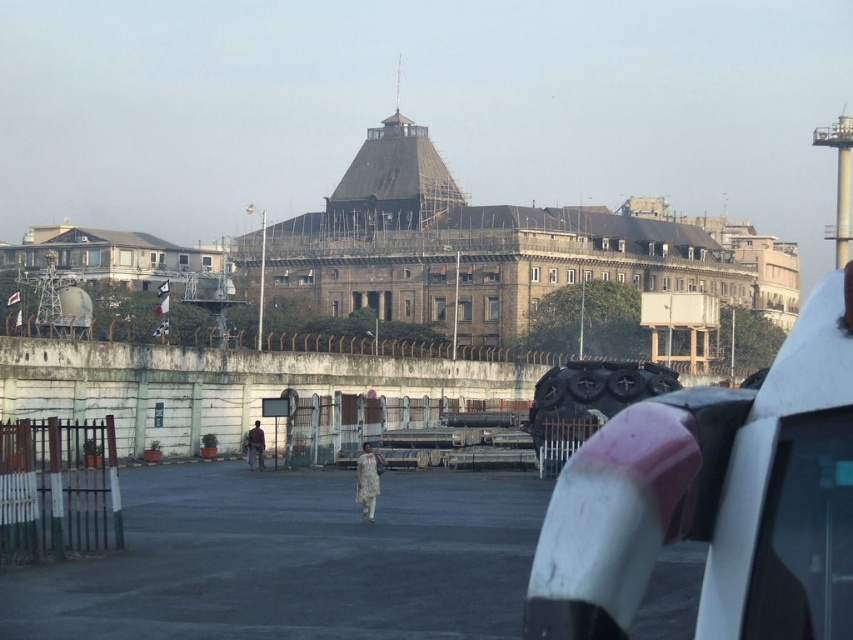
Question: Considering the real-world distances, which object is farthest from the dull floral dress at center?

Choices:
 (A) light brown fabric dress at center
 (B) brown stone building at upper left

Answer: (B)

Question: Can you confirm if dull floral dress at center is positioned to the left of light brown fabric dress at center?

Choices:
 (A) yes
 (B) no

Answer: (B)

Question: Does dull floral dress at center appear on the right side of light brown fabric dress at center?

Choices:
 (A) yes
 (B) no

Answer: (A)

Question: Which point is farther to the camera?

Choices:
 (A) light brown fabric dress at center
 (B) brown stone building at upper left

Answer: (B)

Question: Does brown stone building at upper left appear under light brown fabric dress at center?

Choices:
 (A) no
 (B) yes

Answer: (A)

Question: Which object is closer to the camera taking this photo?

Choices:
 (A) dull floral dress at center
 (B) light brown fabric dress at center

Answer: (A)